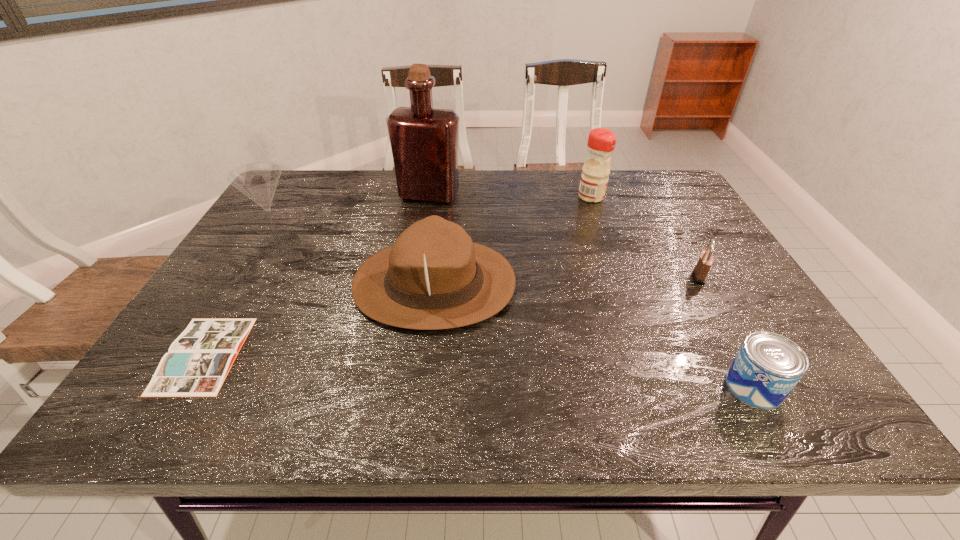
Where is `free space between the book and the can`? free space between the book and the can is located at coordinates (479, 370).

This screenshot has height=540, width=960. In order to click on free space that is in between the flute glass and the book in this screenshot , I will do `click(242, 299)`.

This screenshot has height=540, width=960. Identify the location of free space between the padlock and the fedora. (566, 280).

The width and height of the screenshot is (960, 540). I want to click on vacant space that's between the tallest object and the shortest object, so click(316, 274).

Find the location of a particular element. This screenshot has width=960, height=540. vacant space that is in between the fedora and the fifth object from left to right is located at coordinates [513, 240].

The height and width of the screenshot is (540, 960). What are the coordinates of `free area in between the padlock and the tallest object` in the screenshot? It's located at (564, 235).

In order to click on free space that is in between the fedora and the can in this screenshot , I will do `click(594, 335)`.

Where is `empty space that is in between the shortest object and the tallest object`? This screenshot has width=960, height=540. empty space that is in between the shortest object and the tallest object is located at coordinates click(x=316, y=274).

Locate an element on the screen. The width and height of the screenshot is (960, 540). free space between the liquor and the book is located at coordinates (316, 274).

I want to click on object that stands as the fifth closest to the liquor, so click(x=700, y=272).